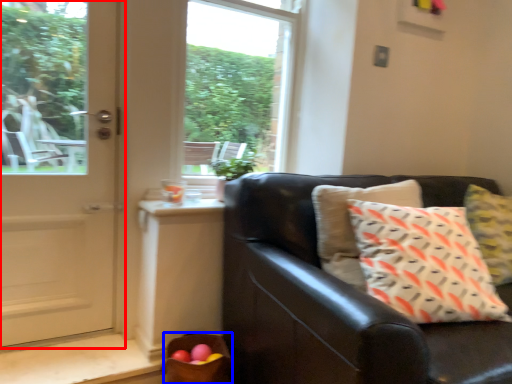
Question: Which point is further to the camera, door (highlighted by a red box) or basket (highlighted by a blue box)?

Choices:
 (A) door
 (B) basket

Answer: (B)